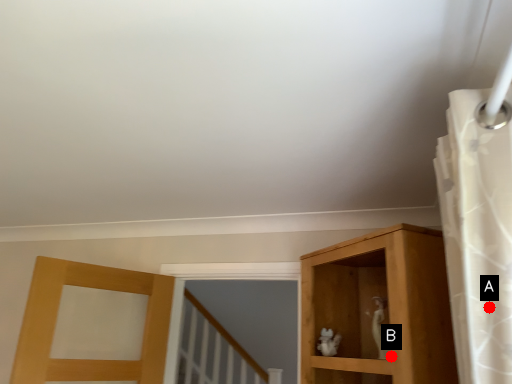
Question: Two points are circled on the image, labeled by A and B beside each circle. Which of the following is the closest to the observer?

Choices:
 (A) A is closer
 (B) B is closer

Answer: (A)